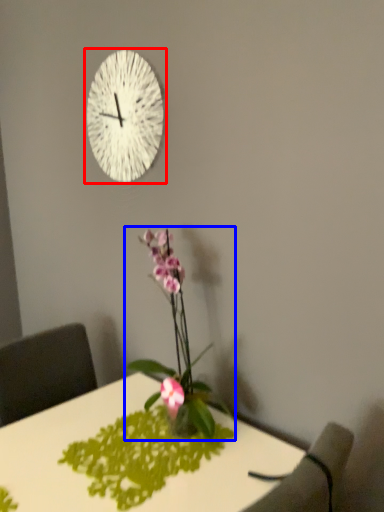
Question: Which of the following is the closest to the observer, wall clock (highlighted by a red box) or houseplant (highlighted by a blue box)?

Choices:
 (A) wall clock
 (B) houseplant

Answer: (B)